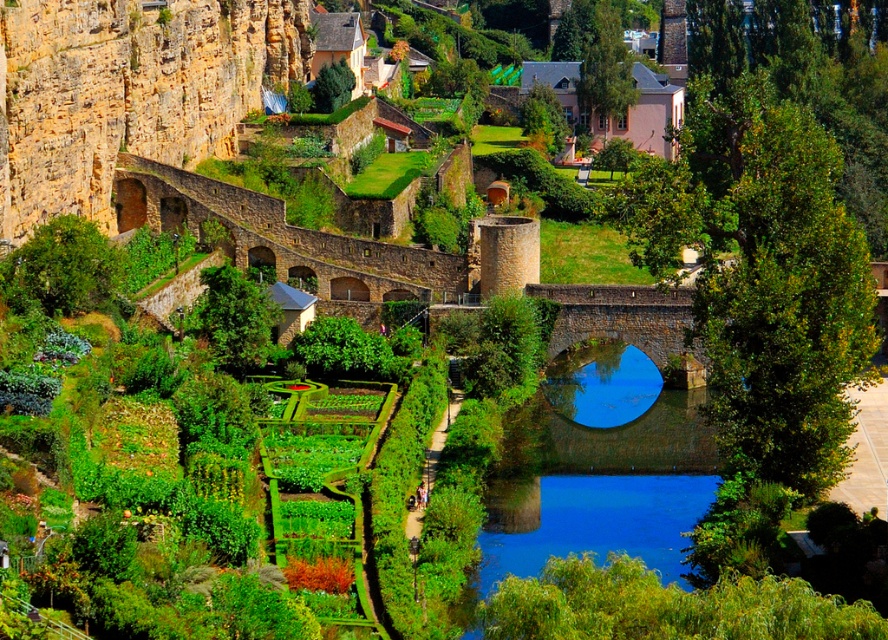
Between yellow stone cliff at upper left and blue stone bridge at center, which one appears on the right side from the viewer's perspective?

From the viewer's perspective, blue stone bridge at center appears more on the right side.

Does yellow stone cliff at upper left lie behind blue stone bridge at center?

Yes, yellow stone cliff at upper left is behind blue stone bridge at center.

Describe the element at coordinates (128, 90) in the screenshot. The image size is (888, 640). I see `yellow stone cliff at upper left` at that location.

You are a GUI agent. You are given a task and a screenshot of the screen. Output one action in this format:
    pyautogui.click(x=<x>, y=<y>)
    Task: Click on the yellow stone cliff at upper left
    This screenshot has width=888, height=640.
    Given the screenshot: What is the action you would take?
    pyautogui.click(x=128, y=90)